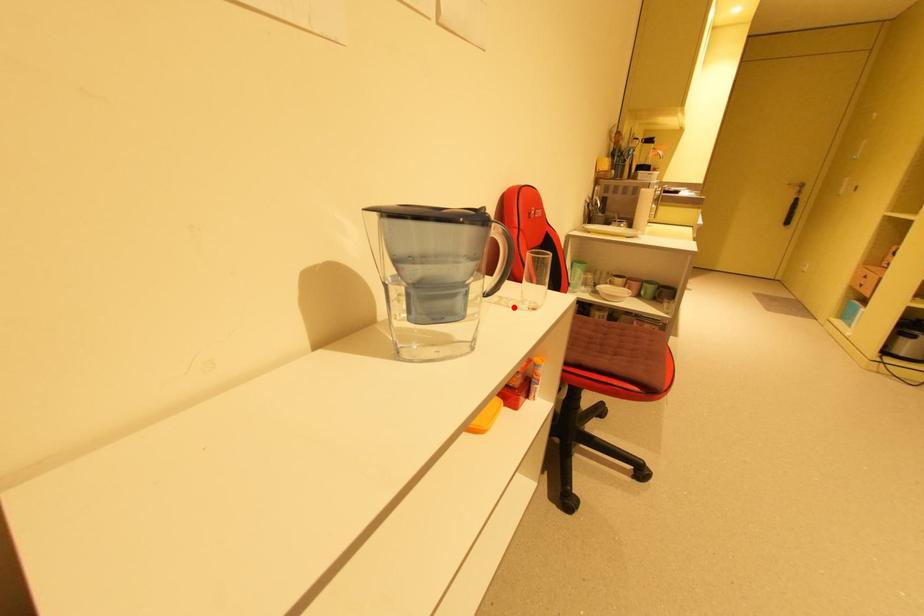
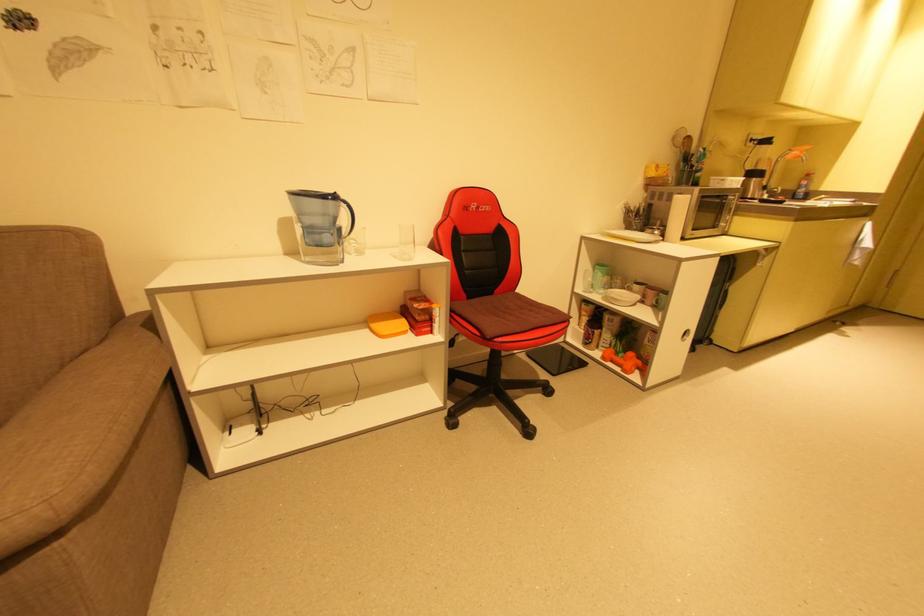
Locate, in the second image, the point that corresponds to the highlighted location in the first image.

(400, 257)